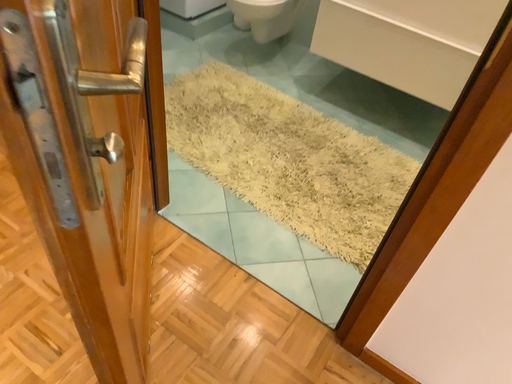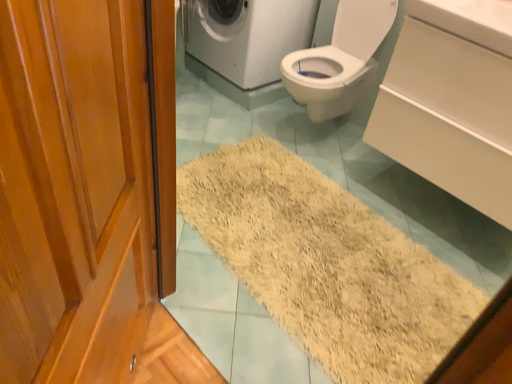
Question: How did the camera likely rotate when shooting the video?

Choices:
 (A) rotated downward
 (B) rotated upward

Answer: (B)